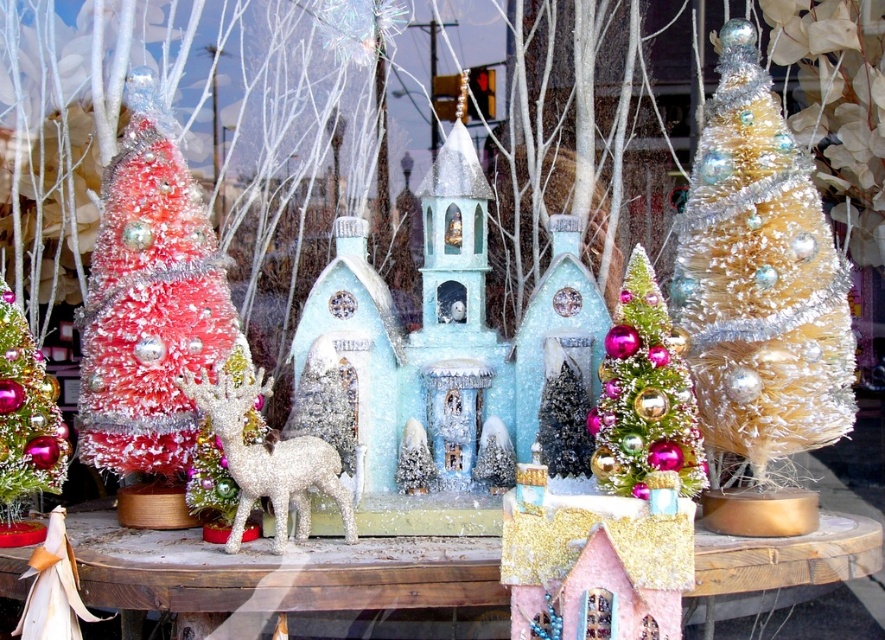
Does gold tinsel christmas tree at right have a greater height compared to shiny red tinsel christmas tree at left?

Indeed, gold tinsel christmas tree at right has a greater height compared to shiny red tinsel christmas tree at left.

Who is lower down, gold tinsel christmas tree at right or shiny red tinsel christmas tree at left?

Positioned lower is shiny red tinsel christmas tree at left.

Which is in front, point (764, 106) or point (113, 300)?

Point (764, 106) is more forward.

Where is `gold tinsel christmas tree at right`? This screenshot has height=640, width=885. gold tinsel christmas tree at right is located at coordinates (760, 276).

Is shiny red tinsel christmas tree at left below shiny pink tinsel christmas tree at center?

Incorrect, shiny red tinsel christmas tree at left is not positioned below shiny pink tinsel christmas tree at center.

Does shiny red tinsel christmas tree at left have a greater height compared to shiny pink tinsel christmas tree at center?

Correct, shiny red tinsel christmas tree at left is much taller as shiny pink tinsel christmas tree at center.

Does point (85, 436) come closer to viewer compared to point (644, 445)?

That is False.

This screenshot has width=885, height=640. What are the coordinates of `shiny red tinsel christmas tree at left` in the screenshot? It's located at pos(149,304).

Based on the photo, between shiny red tinsel christmas tree at left and shiny silver christmas tree at center, which one appears on the left side from the viewer's perspective?

shiny red tinsel christmas tree at left

Can you confirm if shiny red tinsel christmas tree at left is wider than shiny silver christmas tree at center?

Yes.

Does point (144, 77) come closer to viewer compared to point (580, 442)?

No, it is not.

You are a GUI agent. You are given a task and a screenshot of the screen. Output one action in this format:
    pyautogui.click(x=<x>, y=<y>)
    Task: Click on the shiny red tinsel christmas tree at left
    This screenshot has width=885, height=640.
    Given the screenshot: What is the action you would take?
    pyautogui.click(x=149, y=304)